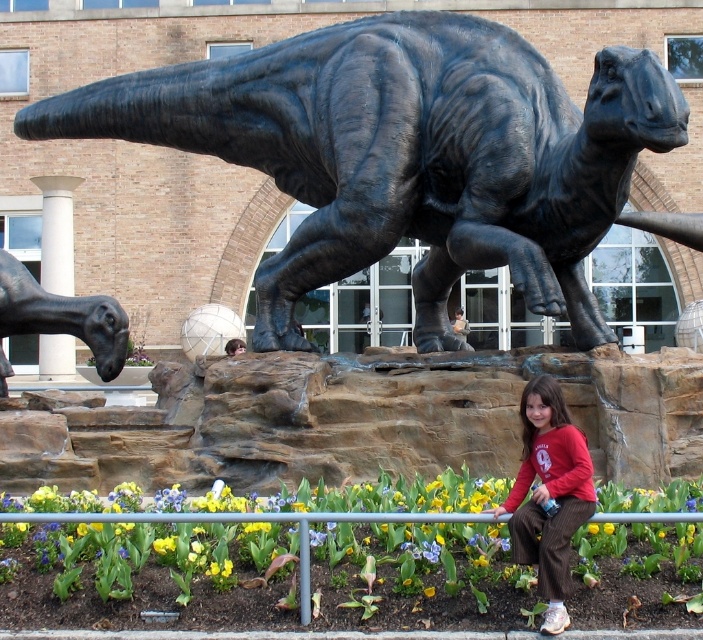
Which is below, matte red shirt at lower right or shiny black statue at left?

Positioned lower is matte red shirt at lower right.

Is point (543, 579) farther from viewer compared to point (91, 332)?

That is False.

Between point (569, 461) and point (103, 353), which one is positioned in front?

Point (569, 461)

Identify the location of matte red shirt at lower right. The height and width of the screenshot is (640, 703). pos(548,493).

Is point (299, 250) behind point (1, 349)?

No, (299, 250) is closer to viewer.

Which is behind, point (598, 214) or point (1, 260)?

The point (1, 260) is more distant.

Where is `black polished stone dinosaur at center`? black polished stone dinosaur at center is located at coordinates [411, 170].

Is point (425, 237) closer to viewer compared to point (553, 513)?

No, (425, 237) is further to viewer.

What do you see at coordinates (411, 170) in the screenshot? The width and height of the screenshot is (703, 640). I see `black polished stone dinosaur at center` at bounding box center [411, 170].

Between point (70, 92) and point (579, 518), which one is positioned in front?

Point (579, 518) is in front.

This screenshot has width=703, height=640. What are the coordinates of `black polished stone dinosaur at center` in the screenshot? It's located at (411, 170).